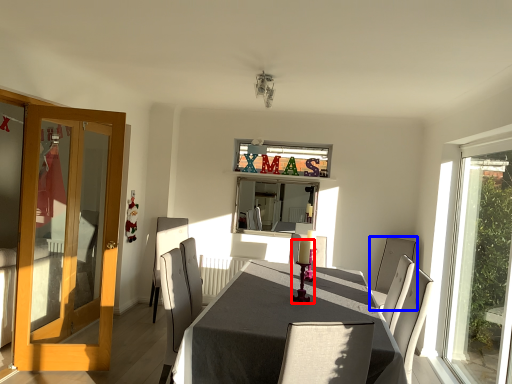
Question: Which of the following is the closest to the observer, candle holder (highlighted by a red box) or chair (highlighted by a blue box)?

Choices:
 (A) candle holder
 (B) chair

Answer: (A)